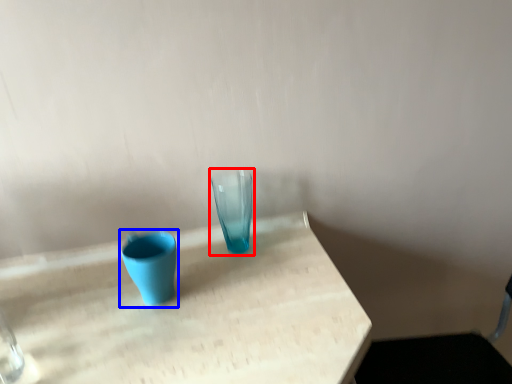
Question: Which point is further to the camera, vase (highlighted by a red box) or vase (highlighted by a blue box)?

Choices:
 (A) vase
 (B) vase

Answer: (A)